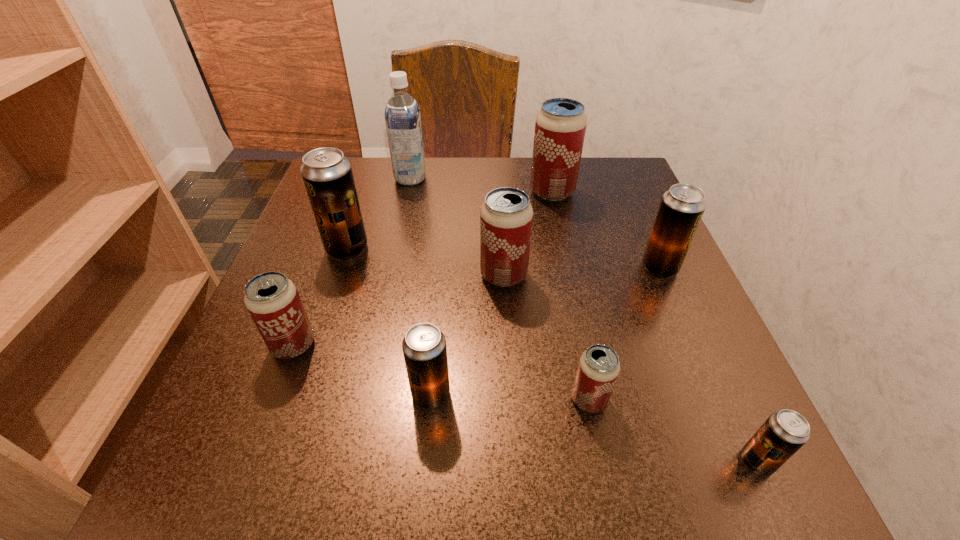
Identify the location of free spot between the smallest red beer can and the second biggest red beer can. (546, 338).

Locate an element on the screen. The height and width of the screenshot is (540, 960). free space that is in between the leftmost black beer can and the third smallest red beer can is located at coordinates (425, 262).

In order to click on free space between the third smallest black beer can and the leftmost red beer can in this screenshot , I will do `click(476, 306)`.

I want to click on vacant area that lies between the smallest black beer can and the second biggest black beer can, so click(x=708, y=364).

Identify which object is the fifth nearest to the leftmost black beer can. Please provide its 2D coordinates. Your answer should be formatted as a tuple, i.e. [(x, y)], where the tuple contains the x and y coordinates of a point satisfying the conditions above.

[(560, 126)]

The height and width of the screenshot is (540, 960). Identify the location of object that stands as the third closest to the second biggest black beer can. (598, 369).

This screenshot has height=540, width=960. Identify the location of beer can that is the sixth closest to the third smallest black beer can. (327, 174).

Select which beer can appears as the sixth closest to the second biggest black beer can. Please provide its 2D coordinates. Your answer should be formatted as a tuple, i.e. [(x, y)], where the tuple contains the x and y coordinates of a point satisfying the conditions above.

[(327, 174)]

Choose which red beer can is the third nearest neighbor to the soya milk. Please provide its 2D coordinates. Your answer should be formatted as a tuple, i.e. [(x, y)], where the tuple contains the x and y coordinates of a point satisfying the conditions above.

[(272, 300)]

You are a GUI agent. You are given a task and a screenshot of the screen. Output one action in this format:
    pyautogui.click(x=<x>, y=<y>)
    Task: Click on the red beer can object that ranks as the second closest to the leftmost red beer can
    
    Given the screenshot: What is the action you would take?
    pyautogui.click(x=598, y=369)